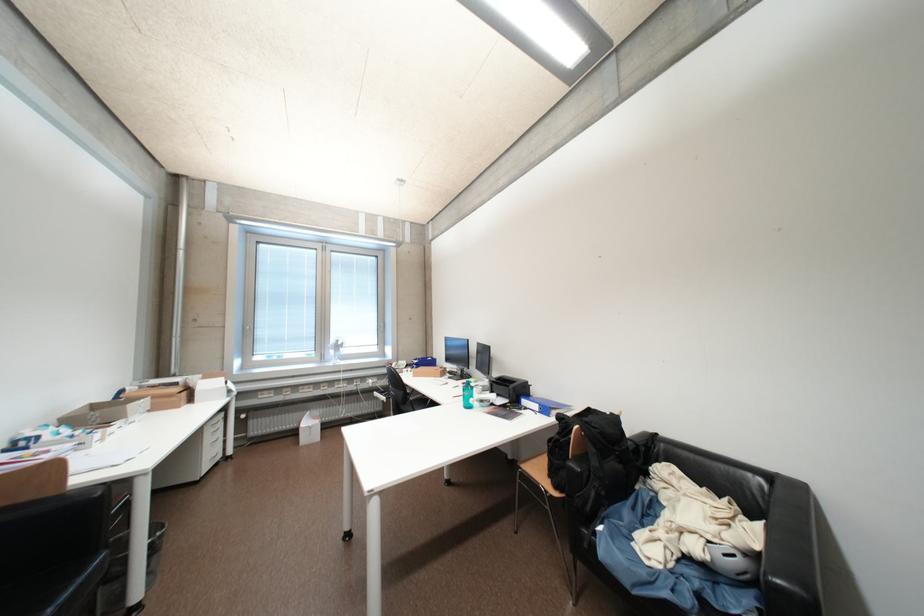
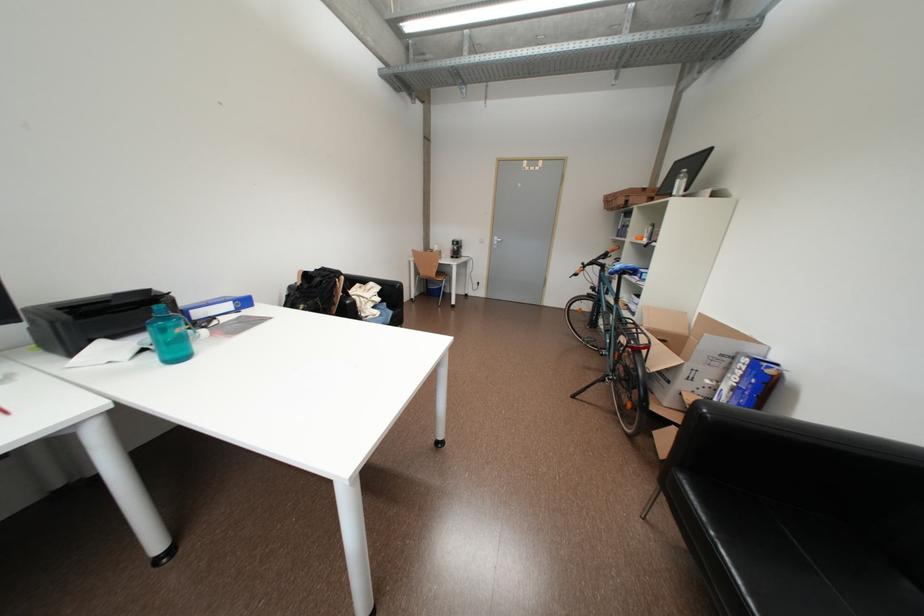
Locate, in the second image, the point that corresponds to (553,411) in the first image.

(252, 304)